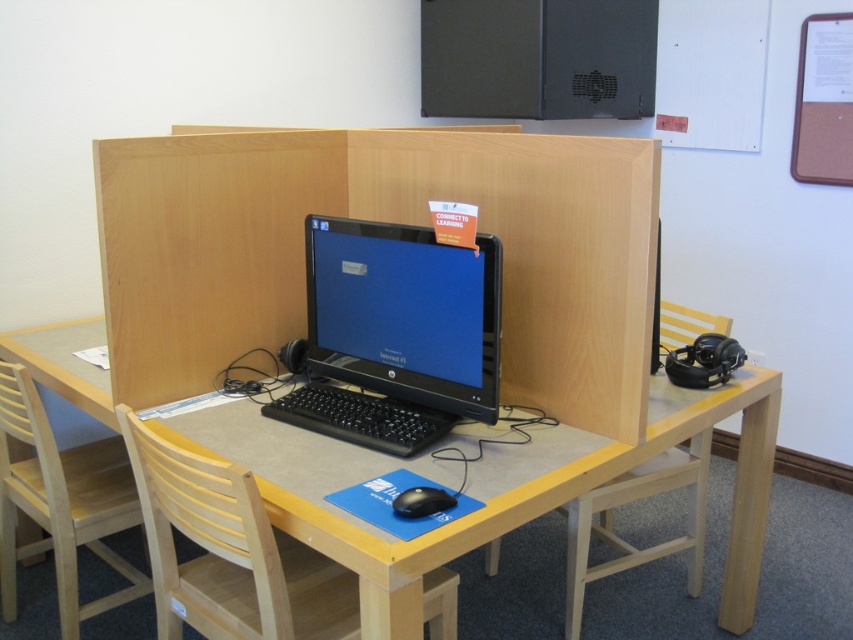
Who is positioned more to the left, wooden chair at center or black plastic mouse at center?

Positioned to the left is wooden chair at center.

Image resolution: width=853 pixels, height=640 pixels. What do you see at coordinates (229, 552) in the screenshot?
I see `wooden chair at center` at bounding box center [229, 552].

Describe the element at coordinates (229, 552) in the screenshot. I see `wooden chair at center` at that location.

You are a GUI agent. You are given a task and a screenshot of the screen. Output one action in this format:
    pyautogui.click(x=<x>, y=<y>)
    Task: Click on the wooden chair at center
    The width and height of the screenshot is (853, 640).
    Given the screenshot: What is the action you would take?
    pyautogui.click(x=229, y=552)

Who is positioned more to the left, black glossy desktop at center or matte black computer desk at center?

From the viewer's perspective, black glossy desktop at center appears more on the left side.

Based on the photo, is black glossy desktop at center behind matte black computer desk at center?

No, black glossy desktop at center is in front of matte black computer desk at center.

Who is more distant from viewer, (317, 282) or (756, 531)?

The point (756, 531) is more distant.

At what (x,y) coordinates should I click in order to perform the action: click on black glossy desktop at center. Please return your answer as a coordinate pair (x, y). This screenshot has width=853, height=640. Looking at the image, I should click on (395, 333).

Is black glossy desktop at center thinner than black plastic mouse at center?

In fact, black glossy desktop at center might be wider than black plastic mouse at center.

Locate an element on the screen. black glossy desktop at center is located at coordinates (395, 333).